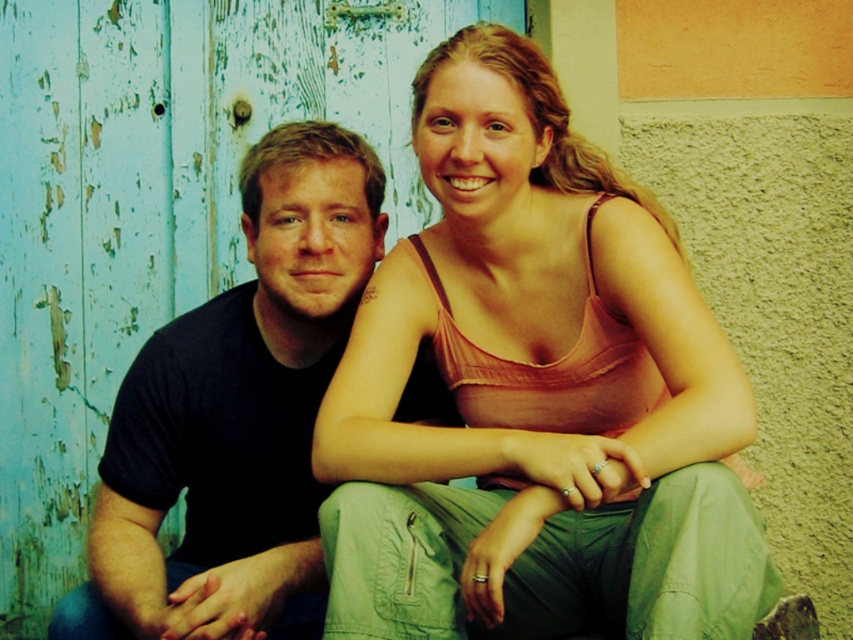
Can you confirm if matte orange tank top at center is positioned above black cotton shirt at left?

Yes, matte orange tank top at center is above black cotton shirt at left.

Which is behind, point (473, 632) or point (187, 324)?

The point (187, 324) is behind.

What are the coordinates of `matte orange tank top at center` in the screenshot? It's located at (537, 396).